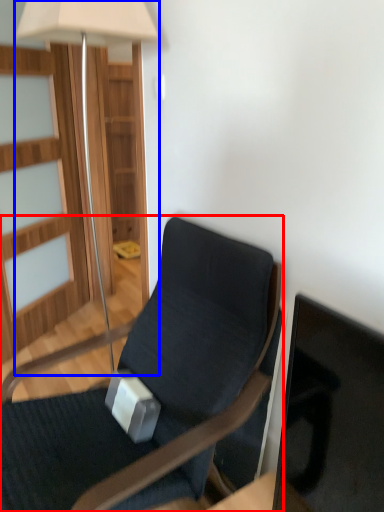
Question: Which object appears farthest to the camera in this image, chair (highlighted by a red box) or lamp (highlighted by a blue box)?

Choices:
 (A) chair
 (B) lamp

Answer: (B)